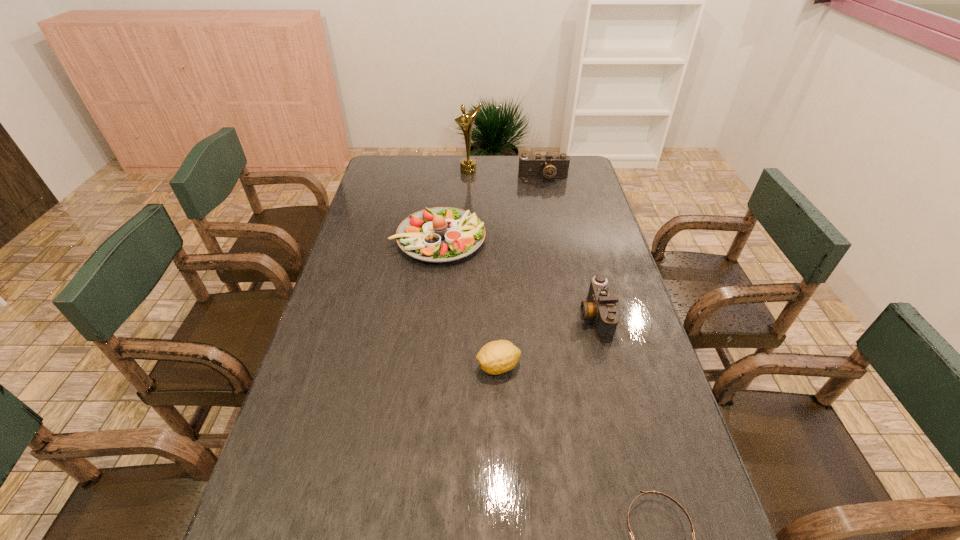
This screenshot has height=540, width=960. I want to click on the tallest object, so click(x=467, y=165).

The width and height of the screenshot is (960, 540). What are the coordinates of `the farther camera` in the screenshot? It's located at (538, 166).

Image resolution: width=960 pixels, height=540 pixels. I want to click on the fourth nearest object, so click(x=441, y=234).

Locate an element on the screen. This screenshot has height=540, width=960. the nearer camera is located at coordinates (601, 306).

The height and width of the screenshot is (540, 960). I want to click on lemon, so click(496, 357).

Where is `free space located on the front-facing side of the tallest object`? free space located on the front-facing side of the tallest object is located at coordinates (467, 230).

This screenshot has height=540, width=960. What are the coordinates of `vacant space located 0.070m on the front-facing side of the farther camera` in the screenshot? It's located at (546, 193).

Locate an element on the screen. The image size is (960, 540). free space located 0.190m on the back of the third farthest object is located at coordinates (444, 186).

Image resolution: width=960 pixels, height=540 pixels. What are the coordinates of `vacant space located on the lens of the nearer camera` in the screenshot? It's located at (463, 316).

You are a GUI agent. You are given a task and a screenshot of the screen. Output one action in this format:
    pyautogui.click(x=<x>, y=<y>)
    Task: Click on the blank space located 0.350m on the lens of the nearer camera
    This screenshot has height=540, width=960.
    Given the screenshot: What is the action you would take?
    pyautogui.click(x=455, y=316)